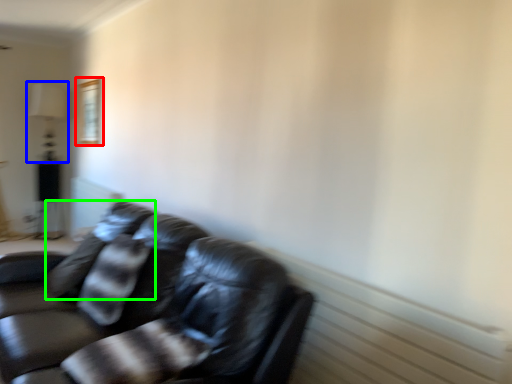
Question: Which is nearer to the picture frame (highlighted by a red box)? lamp (highlighted by a blue box) or pillow (highlighted by a green box).

Choices:
 (A) lamp
 (B) pillow

Answer: (A)